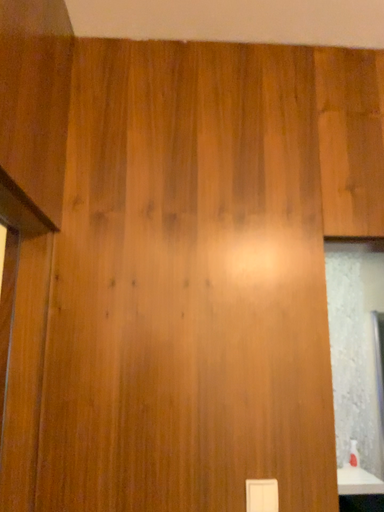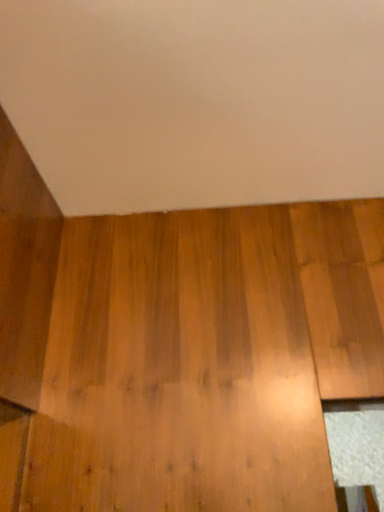
Question: Which way did the camera rotate in the video?

Choices:
 (A) rotated downward
 (B) rotated upward

Answer: (B)